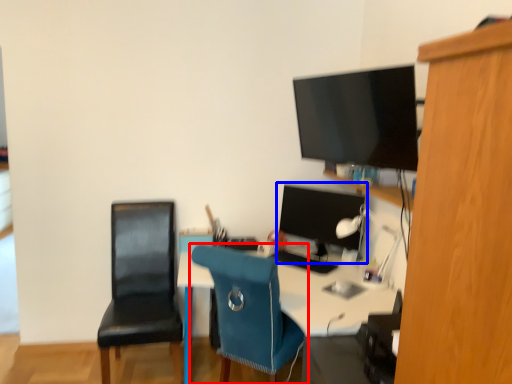
Question: Which point is further to the camera, chair (highlighted by a red box) or computer monitor (highlighted by a blue box)?

Choices:
 (A) chair
 (B) computer monitor

Answer: (B)